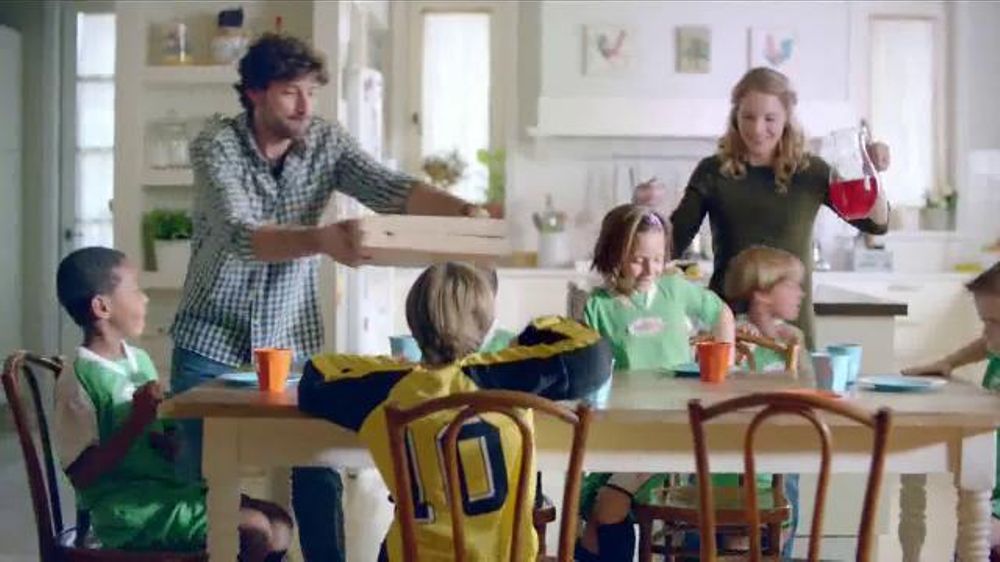
I want to click on windows, so tap(452, 67), tap(928, 81), tap(101, 46), tap(100, 96), tap(94, 172).